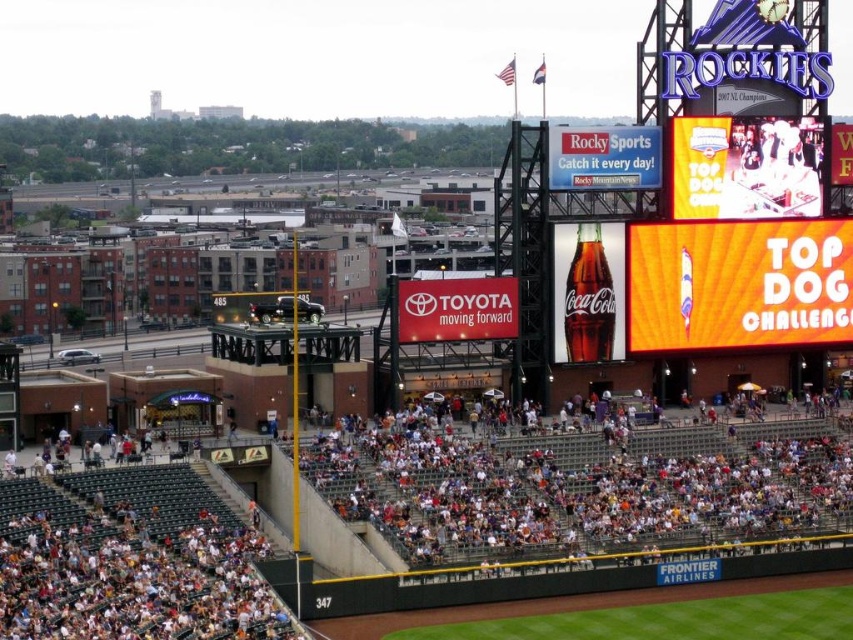
Is multicolored plastic seats at center positioned behind yellow fabric scoreboard at upper right?

No, it is in front of yellow fabric scoreboard at upper right.

Who is more distant from viewer, (611,541) or (660,253)?

Positioned behind is point (660,253).

Find the location of `multicolored plastic seats at center`. multicolored plastic seats at center is located at coordinates (581, 486).

Can you confirm if white plastic seats at lower center is bigger than multicolored plastic seats at center?

Indeed, white plastic seats at lower center has a larger size compared to multicolored plastic seats at center.

Which is behind, point (520, 490) or point (753, 515)?

The point (753, 515) is behind.

What do you see at coordinates (573, 500) in the screenshot? I see `white plastic seats at lower center` at bounding box center [573, 500].

The image size is (853, 640). Find the location of `white plastic seats at lower center`. white plastic seats at lower center is located at coordinates (573, 500).

Who is shorter, white plastic seats at lower center or yellow fabric scoreboard at upper right?

yellow fabric scoreboard at upper right

Is white plastic seats at lower center to the left of yellow fabric scoreboard at upper right from the viewer's perspective?

Yes, white plastic seats at lower center is to the left of yellow fabric scoreboard at upper right.

Who is more forward, (x=705, y=468) or (x=798, y=344)?

Point (x=705, y=468)

The width and height of the screenshot is (853, 640). I want to click on white plastic seats at lower center, so click(x=573, y=500).